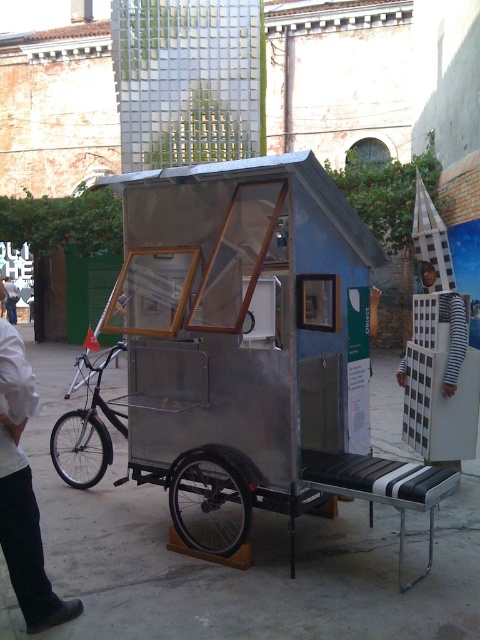
Question: Which object is positioned farthest from the black matte bicycle at left?

Choices:
 (A) silver metallic wheel at lower center
 (B) white striped shirt at lower right

Answer: (B)

Question: Which point is farther to the camera?

Choices:
 (A) silver metallic wheel at left
 (B) black matte bicycle at left

Answer: (A)

Question: Which of the following is the closest to the observer?

Choices:
 (A) (52, 625)
 (B) (14, 314)
 (C) (70, 428)
 (D) (204, 522)

Answer: (A)

Question: Is silver metallic wheel at lower center positioned in front of black matte bicycle at left?

Choices:
 (A) no
 (B) yes

Answer: (B)

Question: Can you confirm if metallic silver tricycle at center is positioned to the right of white striped shirt at lower right?

Choices:
 (A) no
 (B) yes

Answer: (B)

Question: Is black matte bicycle at left further to the viewer compared to silver metallic wheel at left?

Choices:
 (A) no
 (B) yes

Answer: (A)